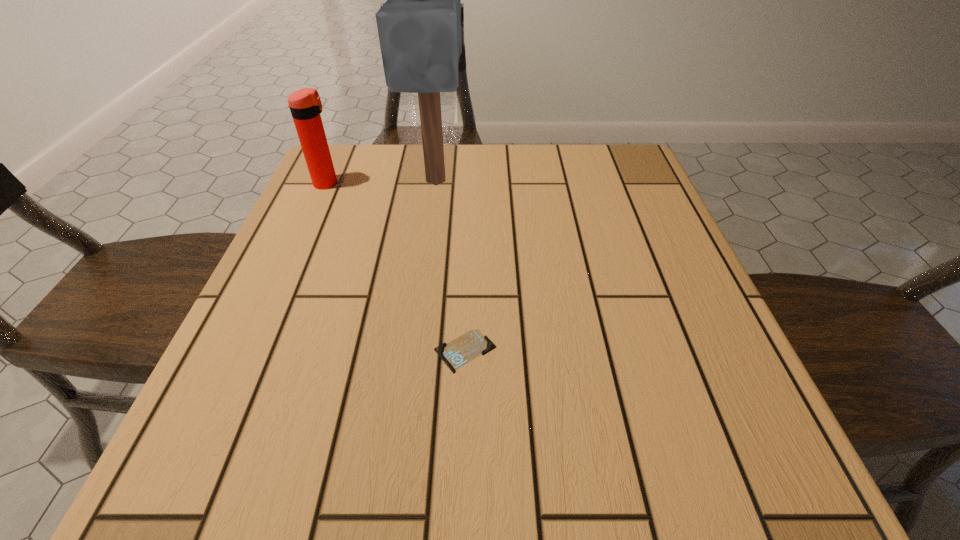
I want to click on vacant area in the image that satisfies the following two spatial constraints: 1. on the back side of the second shortest object; 2. on the right side of the tallest object, so click(x=328, y=181).

You are a GUI agent. You are given a task and a screenshot of the screen. Output one action in this format:
    pyautogui.click(x=<x>, y=<y>)
    Task: Click on the free space that satisfies the following two spatial constraints: 1. on the back side of the tallest object; 2. on the left side of the second tallest object
    
    Given the screenshot: What is the action you would take?
    pyautogui.click(x=328, y=181)

Locate an element on the screen. free space that satisfies the following two spatial constraints: 1. on the front side of the tallest object; 2. on the right side of the shortest object is located at coordinates (415, 350).

At what (x,y) coordinates should I click in order to perform the action: click on free space that satisfies the following two spatial constraints: 1. on the back side of the tallest object; 2. on the right side of the thermos bottle. Please return your answer as a coordinate pair (x, y). This screenshot has width=960, height=540. Looking at the image, I should click on (328, 181).

Locate an element on the screen. The image size is (960, 540). vacant space that satisfies the following two spatial constraints: 1. on the front side of the shortest object; 2. on the left side of the tallest object is located at coordinates (415, 350).